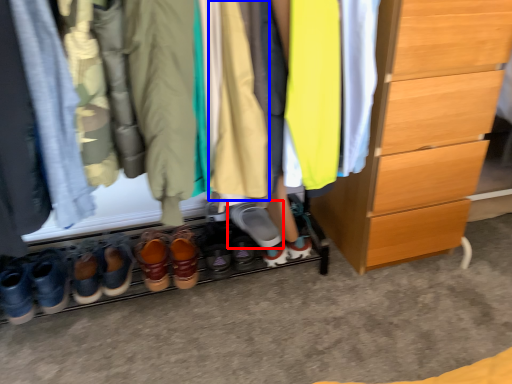
Question: Which point is closer to the camera, footwear (highlighted by a red box) or clothing (highlighted by a blue box)?

Choices:
 (A) footwear
 (B) clothing

Answer: (B)